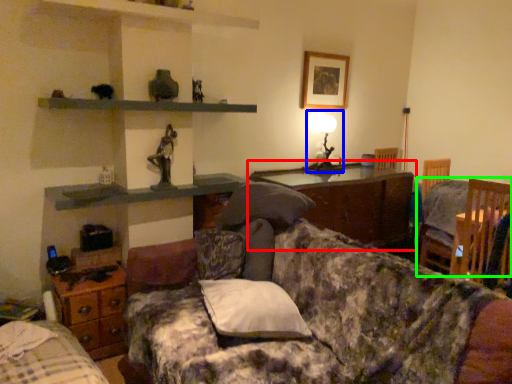
Question: Based on their relative distances, which object is nearer to cabinetry (highlighted by a red box)? Choose from table lamp (highlighted by a blue box) and chair (highlighted by a green box).

Choices:
 (A) table lamp
 (B) chair

Answer: (A)